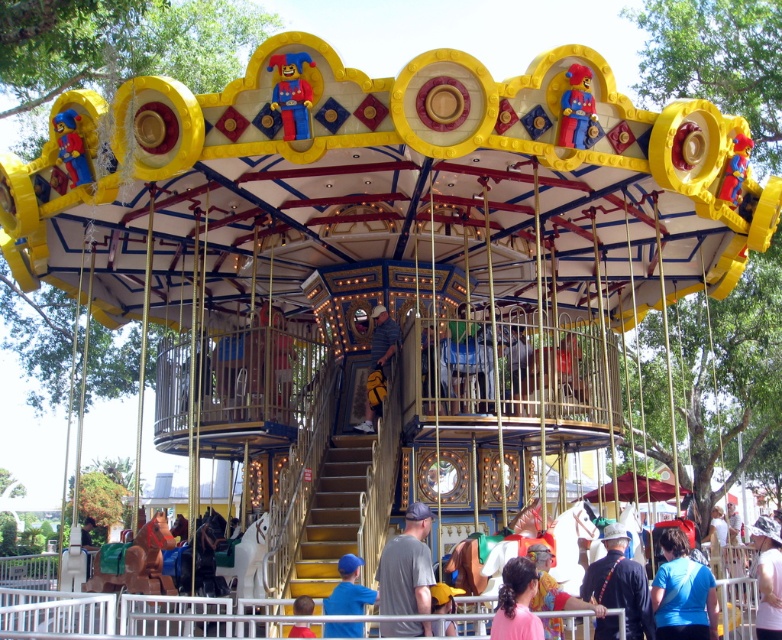
Question: Which point is closer to the camera taking this photo?

Choices:
 (A) (375, 333)
 (B) (386, 634)

Answer: (B)

Question: Where is dark blue shirt at center located in relation to matte gray shirt at lower center in the image?

Choices:
 (A) above
 (B) below

Answer: (A)

Question: Can you confirm if dark blue shirt at center is bigger than matte gray shirt at lower center?

Choices:
 (A) no
 (B) yes

Answer: (A)

Question: Which point appears farthest from the camera in this image?

Choices:
 (A) (626, 540)
 (B) (389, 324)
 (C) (404, 624)

Answer: (B)

Question: Which of these objects is positioned closest to the dark blue shirt at center?

Choices:
 (A) pink fabric ponytail at lower center
 (B) yellow fabric bag at center
 (C) matte gray shirt at lower center
 (D) gray cotton shirt at center

Answer: (A)

Question: Observing the image, what is the correct spatial positioning of blue fabric shirt at lower right in reference to dark blue shirt at center?

Choices:
 (A) below
 (B) above

Answer: (A)